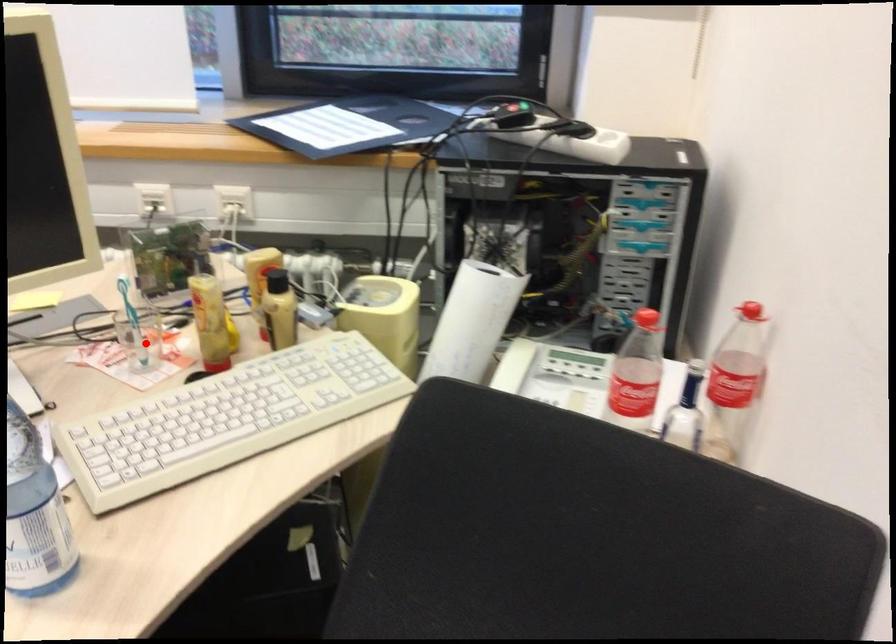
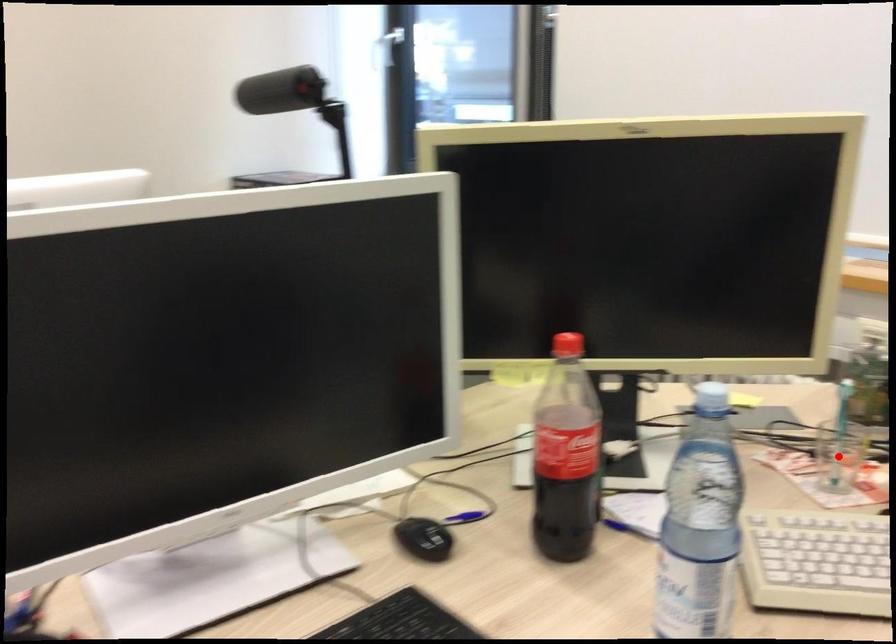
I am providing you with two images of the same scene from different viewpoints. A red point is marked on the first image and another point is marked on the second image. Is the marked point in image1 the same physical position as the marked point in image2?

Yes